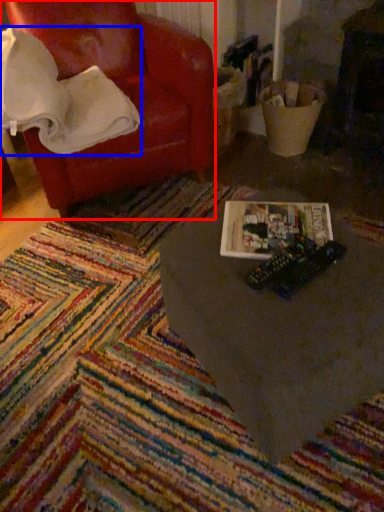
Question: Which object is closer to the camera taking this photo, chair (highlighted by a red box) or blanket (highlighted by a blue box)?

Choices:
 (A) chair
 (B) blanket

Answer: (B)